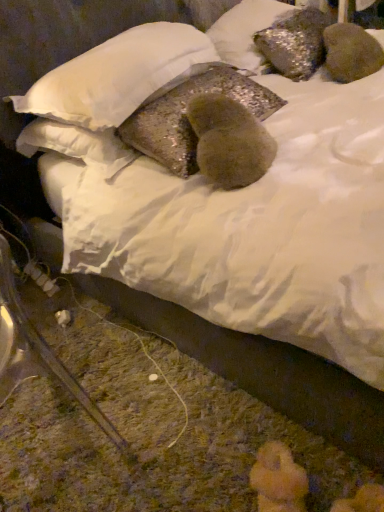
Question: Considering the relative sizes of sparkly metallic pillow at upper center, which is counted as the 1th pillow, starting from the top, and shiny metallic pillow at center, the 2th pillow when ordered from top to bottom, in the image provided, is sparkly metallic pillow at upper center, which is counted as the 1th pillow, starting from the top, shorter than shiny metallic pillow at center, the 2th pillow when ordered from top to bottom,?

Choices:
 (A) yes
 (B) no

Answer: (B)

Question: Is sparkly metallic pillow at upper center, the 3th pillow positioned from the bottom, taller than shiny metallic pillow at center, which is the second pillow from bottom to top?

Choices:
 (A) no
 (B) yes

Answer: (B)

Question: Is sparkly metallic pillow at upper center, the 3th pillow positioned from the bottom, further to the viewer compared to shiny metallic pillow at center, which is the second pillow from bottom to top?

Choices:
 (A) yes
 (B) no

Answer: (A)

Question: Does sparkly metallic pillow at upper center, the 3th pillow positioned from the bottom, appear on the right side of shiny metallic pillow at center, the 2th pillow when ordered from top to bottom?

Choices:
 (A) no
 (B) yes

Answer: (B)

Question: From the image's perspective, does sparkly metallic pillow at upper center, which is counted as the 1th pillow, starting from the top, appear lower than shiny metallic pillow at center, which is the second pillow from bottom to top?

Choices:
 (A) no
 (B) yes

Answer: (A)

Question: Can you confirm if sparkly metallic pillow at upper center, the 3th pillow positioned from the bottom, is wider than shiny metallic pillow at center, which is the second pillow from bottom to top?

Choices:
 (A) yes
 (B) no

Answer: (B)

Question: Is glittery fabric pillow at center, the 3th pillow in the top-to-bottom sequence, wider than shiny metallic pillow at center, the 2th pillow when ordered from top to bottom?

Choices:
 (A) yes
 (B) no

Answer: (B)

Question: From the image's perspective, would you say glittery fabric pillow at center, the 3th pillow in the top-to-bottom sequence, is shown under shiny metallic pillow at center, which is the second pillow from bottom to top?

Choices:
 (A) no
 (B) yes

Answer: (B)

Question: Can you confirm if glittery fabric pillow at center, the 3th pillow in the top-to-bottom sequence, is taller than shiny metallic pillow at center, which is the second pillow from bottom to top?

Choices:
 (A) no
 (B) yes

Answer: (B)

Question: Can you confirm if glittery fabric pillow at center, marked as the first pillow in a bottom-to-top arrangement, is positioned to the right of shiny metallic pillow at center, the 2th pillow when ordered from top to bottom?

Choices:
 (A) yes
 (B) no

Answer: (A)

Question: From a real-world perspective, is glittery fabric pillow at center, marked as the first pillow in a bottom-to-top arrangement, positioned under shiny metallic pillow at center, the 2th pillow when ordered from top to bottom, based on gravity?

Choices:
 (A) yes
 (B) no

Answer: (A)

Question: Is glittery fabric pillow at center, marked as the first pillow in a bottom-to-top arrangement, looking in the opposite direction of shiny metallic pillow at center, which is the second pillow from bottom to top?

Choices:
 (A) yes
 (B) no

Answer: (A)

Question: Is shiny metallic pillow at center, the 2th pillow when ordered from top to bottom, directly adjacent to glittery fabric pillow at center, the 3th pillow in the top-to-bottom sequence?

Choices:
 (A) no
 (B) yes

Answer: (A)